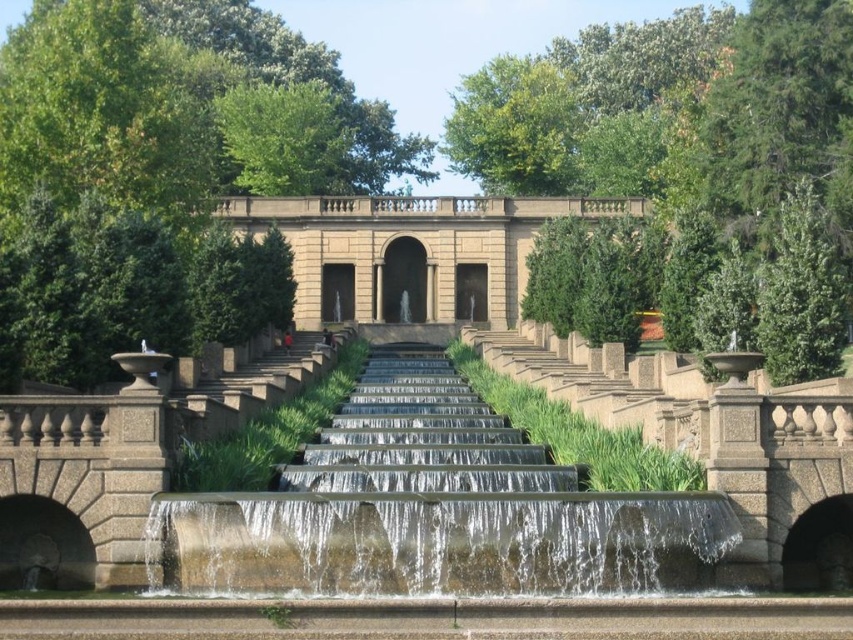
You are standing in the park and want to locate the beige stone palace at center. According to the coordinates provided, where would you find it?

The beige stone palace at center is located at the coordinates point (410, 250).

You are standing at the bottom of the staircase and want to walk towards the beige stone palace at center. Which direction should you move relative to the smooth concrete fountain at center?

To reach the beige stone palace at center, you should move to the right of the smooth concrete fountain at center since the fountain is positioned to the left of the palace.